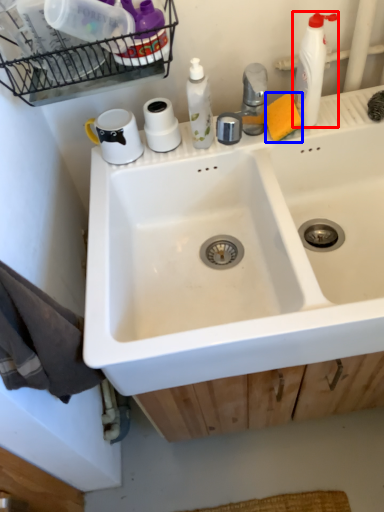
Question: Among these objects, which one is farthest to the camera, cleaning product (highlighted by a red box) or soap (highlighted by a blue box)?

Choices:
 (A) cleaning product
 (B) soap

Answer: (B)